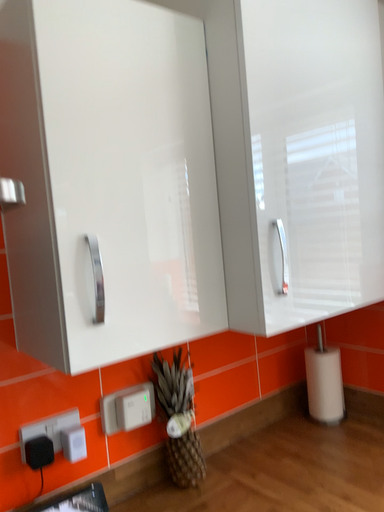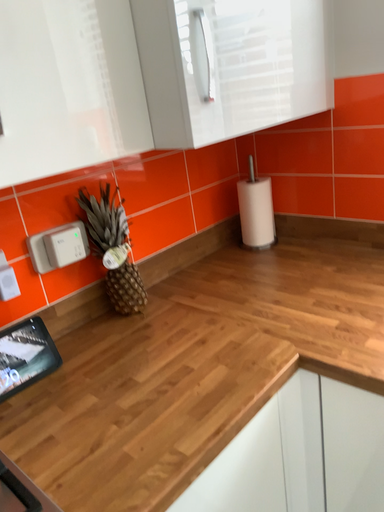
Question: Which way did the camera rotate in the video?

Choices:
 (A) rotated left
 (B) rotated right

Answer: (B)